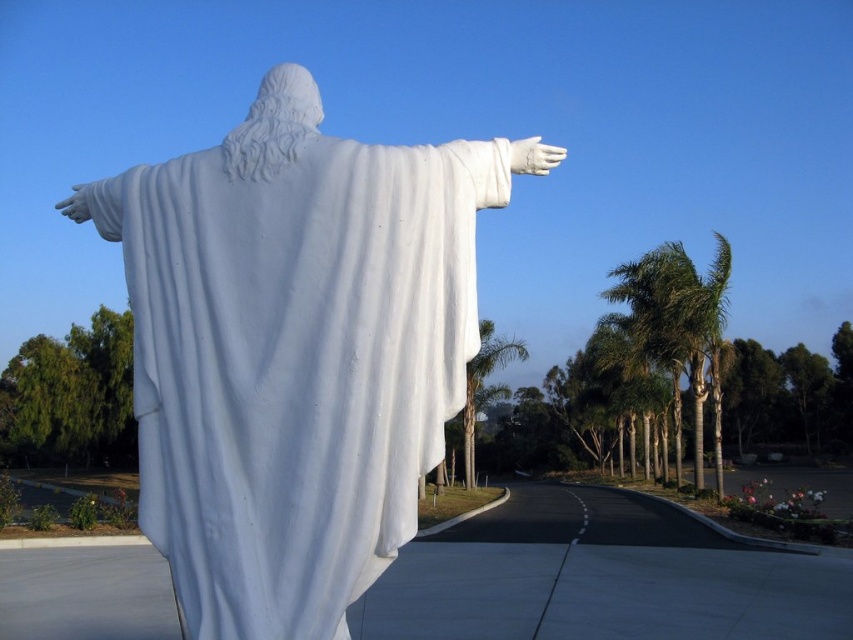
Question: Which point appears farthest from the camera in this image?

Choices:
 (A) (691, 276)
 (B) (479, 385)
 (C) (500, 164)

Answer: (B)

Question: Which point is farther from the camera taking this photo?

Choices:
 (A) (622, 291)
 (B) (161, 301)

Answer: (A)

Question: Is the position of white marble statue at center more distant than that of green leafy palm tree at center?

Choices:
 (A) yes
 (B) no

Answer: (B)

Question: Does white marble statue at center appear on the right side of green leafy palm tree at center?

Choices:
 (A) yes
 (B) no

Answer: (B)

Question: Estimate the real-world distances between objects in this image. Which object is closer to the white marble statue at center?

Choices:
 (A) green leafy palm trees at right
 (B) green leafy palm tree at center

Answer: (B)

Question: Is white marble statue at center above green leafy palm tree at center?

Choices:
 (A) no
 (B) yes

Answer: (B)